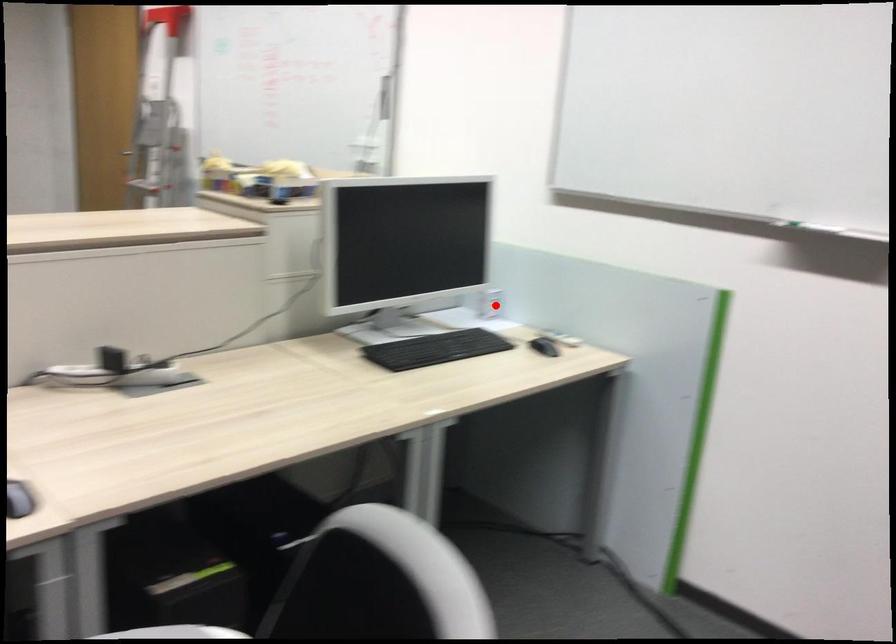
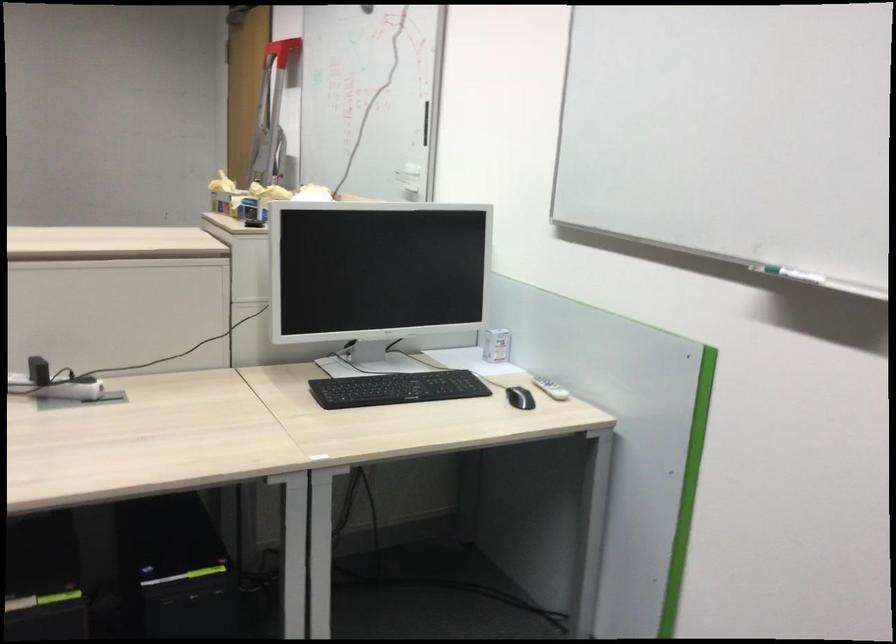
Find the pixel in the second image that matches the highlighted location in the first image.

(495, 345)